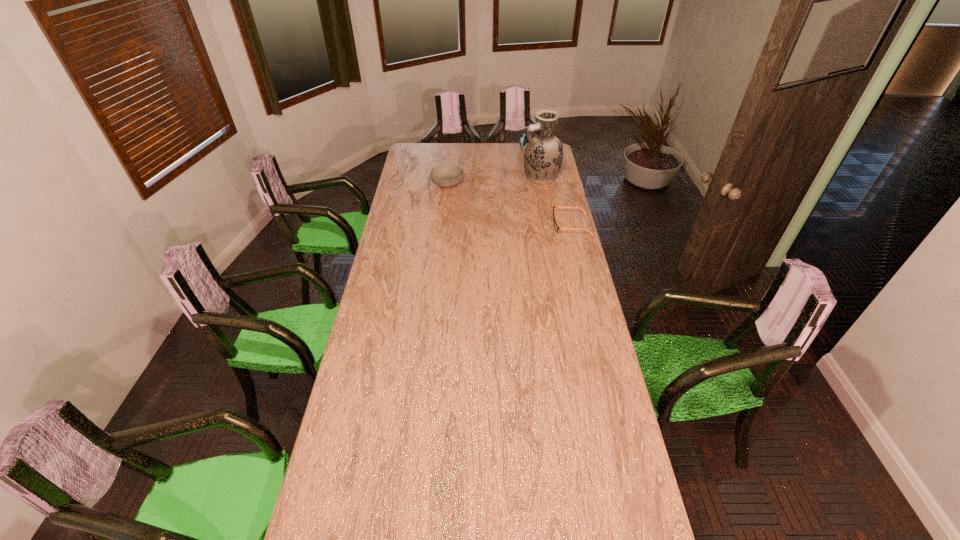
You are a GUI agent. You are given a task and a screenshot of the screen. Output one action in this format:
    pyautogui.click(x=<x>, y=<y>)
    Task: Click on the free space between the spectacles and the leftmost object
    This screenshot has height=540, width=960.
    Given the screenshot: What is the action you would take?
    pyautogui.click(x=510, y=204)

This screenshot has height=540, width=960. In order to click on vacant space in between the leftmost object and the spectacles in this screenshot , I will do `click(510, 204)`.

Locate an element on the screen. This screenshot has width=960, height=540. empty space that is in between the second shortest object and the nearest object is located at coordinates pos(510,204).

In order to click on vacant area that lies between the nearest object and the vase in this screenshot , I will do `click(556, 201)`.

This screenshot has width=960, height=540. What are the coordinates of `free space between the second tallest object and the nearest object` in the screenshot? It's located at (553, 186).

Select which object is the second closest to the tallest object. Please provide its 2D coordinates. Your answer should be formatted as a tuple, i.e. [(x, y)], where the tuple contains the x and y coordinates of a point satisfying the conditions above.

[(556, 227)]

Select which object appears as the third closest to the tallest object. Please provide its 2D coordinates. Your answer should be formatted as a tuple, i.e. [(x, y)], where the tuple contains the x and y coordinates of a point satisfying the conditions above.

[(447, 175)]

This screenshot has height=540, width=960. What are the coordinates of `free space that satisfies the following two spatial constraints: 1. on the front side of the bowl; 2. on the front-facing side of the shortest object` in the screenshot? It's located at (444, 225).

Find the location of a particular element. vacant area that satisfies the following two spatial constraints: 1. on the back side of the second tallest object; 2. on the left side of the leftmost object is located at coordinates (451, 148).